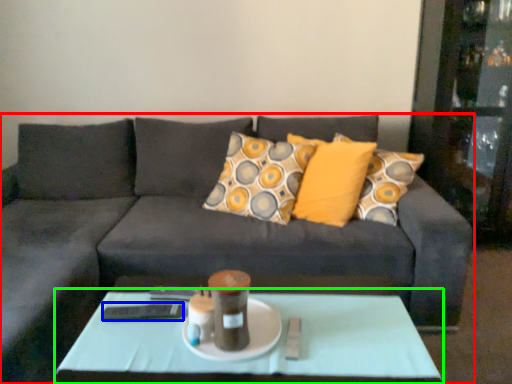
Question: Which is nearer to the studio couch (highlighted by a red box)? remote (highlighted by a blue box) or coffee table (highlighted by a green box).

Choices:
 (A) remote
 (B) coffee table

Answer: (B)